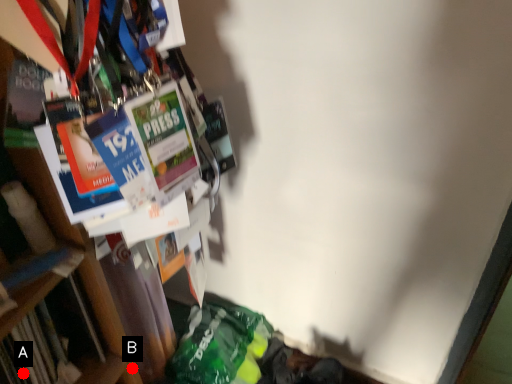
Question: Two points are circled on the image, labeled by A and B beside each circle. Which point is closer to the camera taking this photo?

Choices:
 (A) A is closer
 (B) B is closer

Answer: (A)